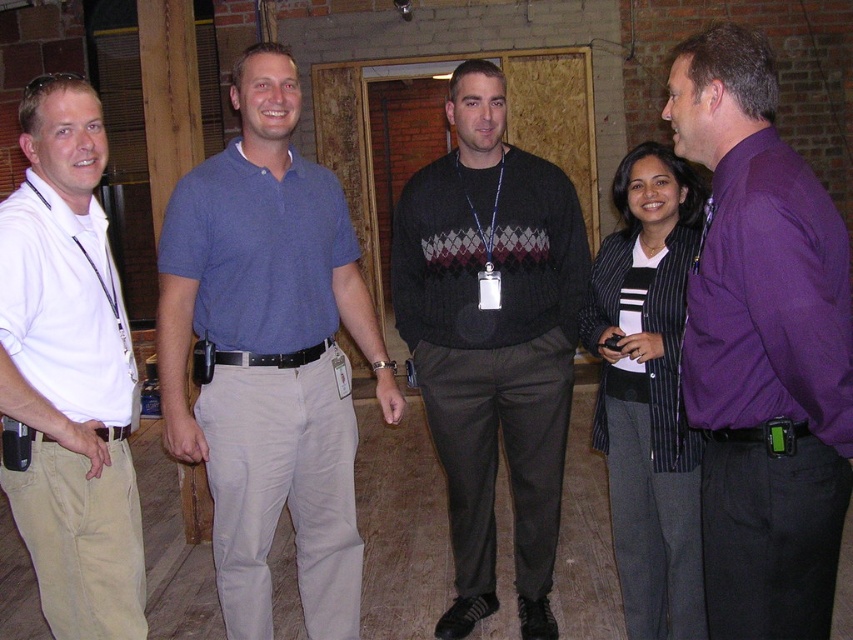
Based on the photo, based on the scene description, which object is larger in size between the blue cotton polo shirt at center and the white cotton shirt at left?

The blue cotton polo shirt at center is larger in size than the white cotton shirt at left.